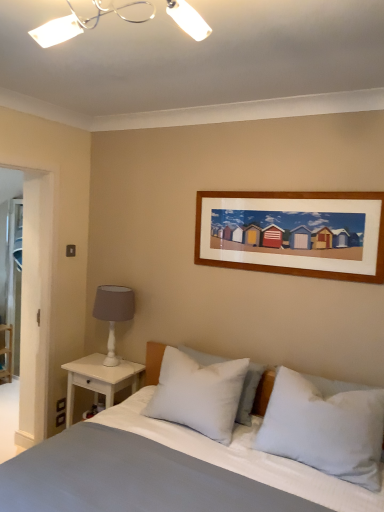
Question: Is white painted wood shelf at left thinner than white plastic light fixture at upper center?

Choices:
 (A) yes
 (B) no

Answer: (A)

Question: Does white painted wood shelf at left have a lesser height compared to white plastic light fixture at upper center?

Choices:
 (A) yes
 (B) no

Answer: (B)

Question: Is white painted wood shelf at left next to white plastic light fixture at upper center?

Choices:
 (A) yes
 (B) no

Answer: (B)

Question: Considering the relative sizes of white painted wood shelf at left and white plastic light fixture at upper center in the image provided, is white painted wood shelf at left taller than white plastic light fixture at upper center?

Choices:
 (A) yes
 (B) no

Answer: (A)

Question: Considering the relative sizes of white painted wood shelf at left and white plastic light fixture at upper center in the image provided, is white painted wood shelf at left wider than white plastic light fixture at upper center?

Choices:
 (A) no
 (B) yes

Answer: (A)

Question: Is the position of white painted wood shelf at left more distant than that of white plastic light fixture at upper center?

Choices:
 (A) no
 (B) yes

Answer: (B)

Question: Does white matte table lamp at left have a smaller size compared to white plastic light fixture at upper center?

Choices:
 (A) yes
 (B) no

Answer: (B)

Question: From a real-world perspective, is white matte table lamp at left physically above white plastic light fixture at upper center?

Choices:
 (A) yes
 (B) no

Answer: (B)

Question: Does white matte table lamp at left appear on the right side of white plastic light fixture at upper center?

Choices:
 (A) no
 (B) yes

Answer: (A)

Question: Is white matte table lamp at left not within white plastic light fixture at upper center?

Choices:
 (A) no
 (B) yes

Answer: (B)

Question: Is white matte table lamp at left far away from white plastic light fixture at upper center?

Choices:
 (A) yes
 (B) no

Answer: (A)

Question: Does white matte table lamp at left have a lesser width compared to white plastic light fixture at upper center?

Choices:
 (A) no
 (B) yes

Answer: (B)

Question: From a real-world perspective, is smooth cotton bed at center under white wood nightstand at left?

Choices:
 (A) yes
 (B) no

Answer: (A)